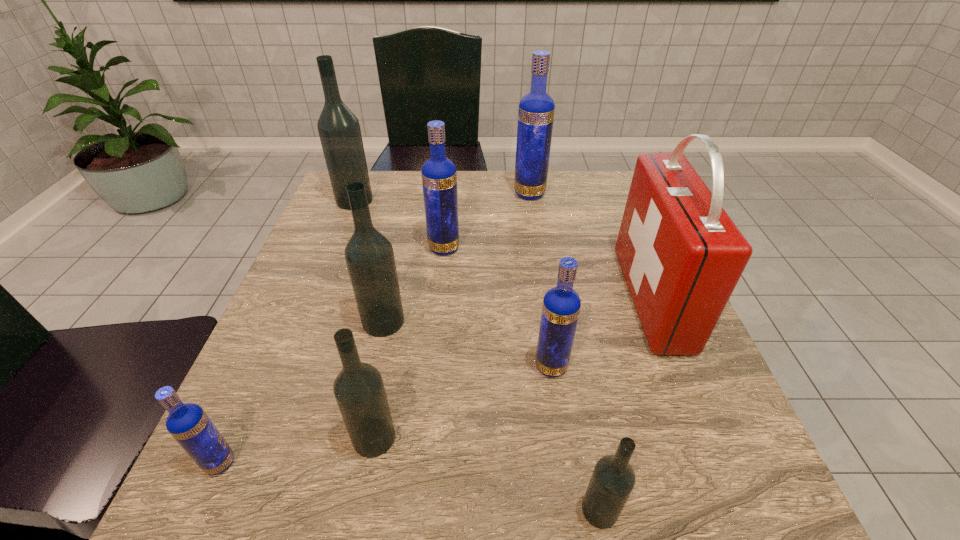
The height and width of the screenshot is (540, 960). In order to click on vacant space positioned 0.290m on the front face of the rightmost object in this screenshot , I will do `click(488, 299)`.

Locate an element on the screen. The width and height of the screenshot is (960, 540). vacant space located on the left of the sixth nearest vodka is located at coordinates (356, 248).

Locate an element on the screen. Image resolution: width=960 pixels, height=540 pixels. free space located on the right of the fifth nearest vodka is located at coordinates (445, 322).

Find the location of `free space located 0.200m on the right of the third biggest blue vodka`. free space located 0.200m on the right of the third biggest blue vodka is located at coordinates (681, 367).

Where is `vacant region located on the back of the second smallest black vodka`? vacant region located on the back of the second smallest black vodka is located at coordinates (392, 345).

Locate an element on the screen. This screenshot has height=540, width=960. free spot located 0.070m on the right of the nearest blue vodka is located at coordinates (282, 463).

You are a GUI agent. You are given a task and a screenshot of the screen. Output one action in this format:
    pyautogui.click(x=<x>, y=<y>)
    Task: Click on the vacant area located on the left of the nearest vodka
    
    Given the screenshot: What is the action you would take?
    pyautogui.click(x=531, y=510)

Where is `object that is positioned at the right edge`? The width and height of the screenshot is (960, 540). object that is positioned at the right edge is located at coordinates click(681, 255).

At what (x,y) coordinates should I click in order to perform the action: click on object present at the far left corner. Please return your answer as a coordinate pair (x, y). The width and height of the screenshot is (960, 540). Looking at the image, I should click on (339, 130).

At what (x,y) coordinates should I click in order to perform the action: click on object that is at the near left corner. Please return your answer as a coordinate pair (x, y). Looking at the image, I should click on (190, 426).